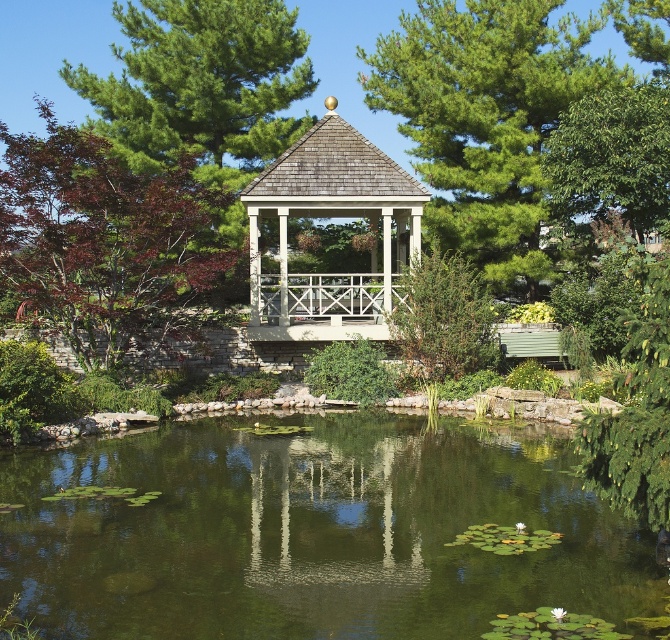
Question: Among these objects, which one is nearest to the camera?

Choices:
 (A) dark red bark tree at center
 (B) wooden gazebo at center
 (C) green pine tree at upper center

Answer: (A)

Question: Among these objects, which one is farthest from the camera?

Choices:
 (A) green textured pine tree at upper left
 (B) green reflective water at center

Answer: (A)

Question: Does dark red bark tree at center have a smaller size compared to green textured pine tree at upper left?

Choices:
 (A) no
 (B) yes

Answer: (A)

Question: Which point is farther to the camera?

Choices:
 (A) (60, 317)
 (B) (165, 120)
 (C) (655, 90)

Answer: (B)

Question: Does green reflective water at center have a larger size compared to dark red bark tree at center?

Choices:
 (A) no
 (B) yes

Answer: (A)

Question: Where is green textured pine tree at upper left located in relation to green leafy tree at upper right in the image?

Choices:
 (A) right
 (B) left

Answer: (B)